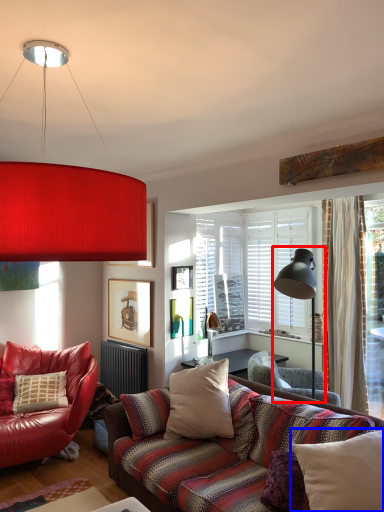
Question: Which object is further to the camera taking this photo, table lamp (highlighted by a red box) or pillow (highlighted by a blue box)?

Choices:
 (A) table lamp
 (B) pillow

Answer: (A)